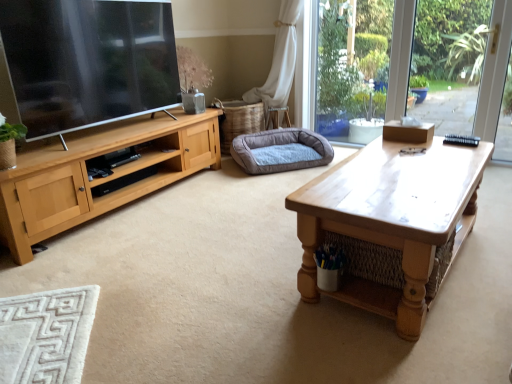
Find the location of a particular element. The width and height of the screenshot is (512, 384). vacant area to the left of wooden coffee table at center is located at coordinates (221, 287).